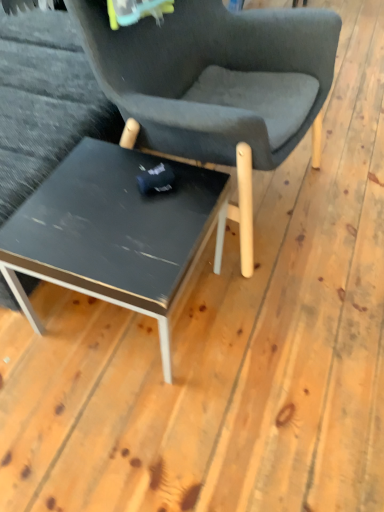
Question: Does matte black table at center turn towards matte black chair at center?

Choices:
 (A) yes
 (B) no

Answer: (A)

Question: Considering the relative sizes of matte black table at center and matte black chair at center in the image provided, is matte black table at center thinner than matte black chair at center?

Choices:
 (A) no
 (B) yes

Answer: (B)

Question: Does matte black table at center come in front of matte black chair at center?

Choices:
 (A) no
 (B) yes

Answer: (A)

Question: From a real-world perspective, is matte black table at center physically above matte black chair at center?

Choices:
 (A) no
 (B) yes

Answer: (A)

Question: Is matte black table at center further to the viewer compared to matte black chair at center?

Choices:
 (A) yes
 (B) no

Answer: (A)

Question: Are matte black table at center and matte black chair at center making contact?

Choices:
 (A) no
 (B) yes

Answer: (A)

Question: Could matte black table at center be considered to be inside matte black chair at center?

Choices:
 (A) yes
 (B) no

Answer: (B)

Question: Does matte black chair at center have a lesser width compared to matte black table at center?

Choices:
 (A) yes
 (B) no

Answer: (B)

Question: Is matte black chair at center not near matte black table at center?

Choices:
 (A) yes
 (B) no

Answer: (B)

Question: Can you confirm if matte black chair at center is wider than matte black table at center?

Choices:
 (A) no
 (B) yes

Answer: (B)

Question: From a real-world perspective, is matte black chair at center below matte black table at center?

Choices:
 (A) no
 (B) yes

Answer: (A)

Question: Is matte black chair at center further to the viewer compared to matte black table at center?

Choices:
 (A) yes
 (B) no

Answer: (B)

Question: Looking at their shapes, would you say matte black table at center is wider or thinner than matte black chair at center?

Choices:
 (A) thin
 (B) wide

Answer: (A)